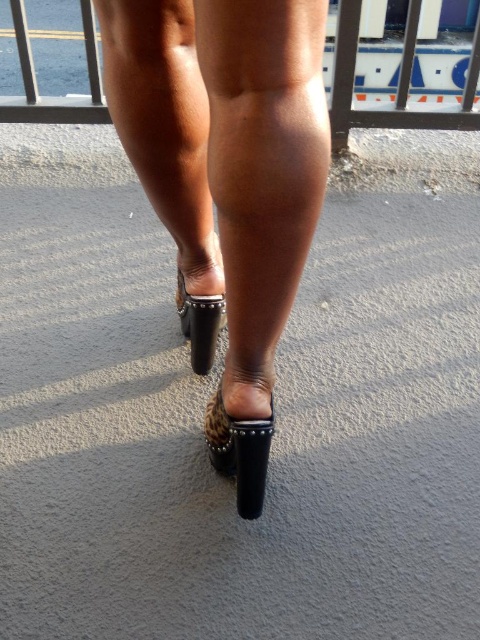
You are a fashion designer observing the image. You need to decide if the leather studded mule at lower center can fit through a space that is the same width as the metallic silver rail at upper center. Can it fit?

The leather studded mule at lower center is thinner than the metallic silver rail at upper center, so yes, the mule can fit through the space that is the same width as the rail.

From the picture: You are a fashion designer observing the image. You notice the leather studded mule at lower center and the leather studded sandal at lower center. Which shoe is covering the other?

The leather studded mule at lower center is positioned over the leather studded sandal at lower center, so it is covering the other shoe.

Looking at this image, you are a fashion designer analyzing footwear in an image. You see the leather studded mule at lower center and the leather studded sandal at lower center. Which one has a higher heel?

The leather studded mule at lower center has a higher heel than the leather studded sandal at lower center because it is much taller as stated in the description.